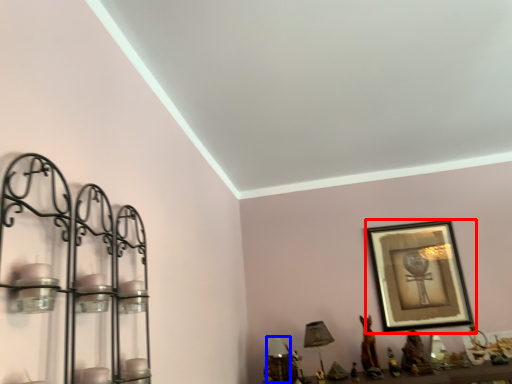
Question: Which point is closer to the camera, picture frame (highlighted by a red box) or table lamp (highlighted by a blue box)?

Choices:
 (A) picture frame
 (B) table lamp

Answer: (B)